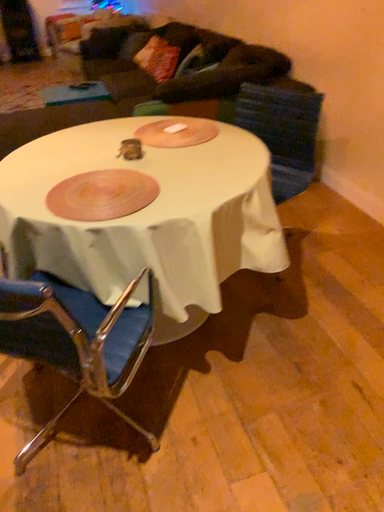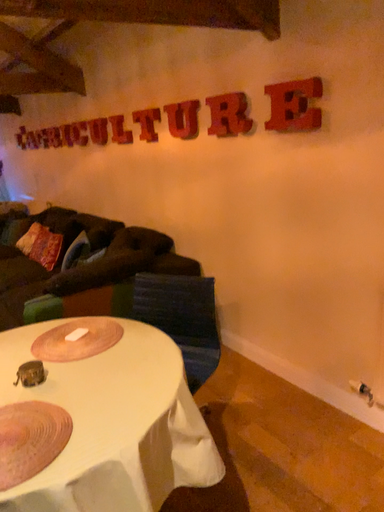
Question: How did the camera likely rotate when shooting the video?

Choices:
 (A) rotated downward
 (B) rotated upward

Answer: (B)